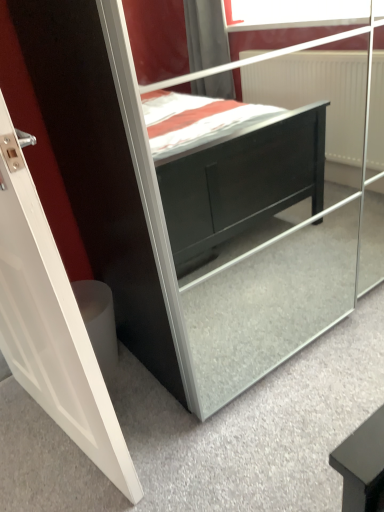
Find the location of a particular element. The width and height of the screenshot is (384, 512). white glossy door at left is located at coordinates (51, 324).

What do you see at coordinates (51, 324) in the screenshot? I see `white glossy door at left` at bounding box center [51, 324].

Looking at this image, measure the distance between white glossy door at left and camera.

The distance of white glossy door at left from camera is 23.46 inches.

At what (x,y) coordinates should I click in order to perform the action: click on white glossy door at left. Please return your answer as a coordinate pair (x, y). The width and height of the screenshot is (384, 512). Looking at the image, I should click on (51, 324).